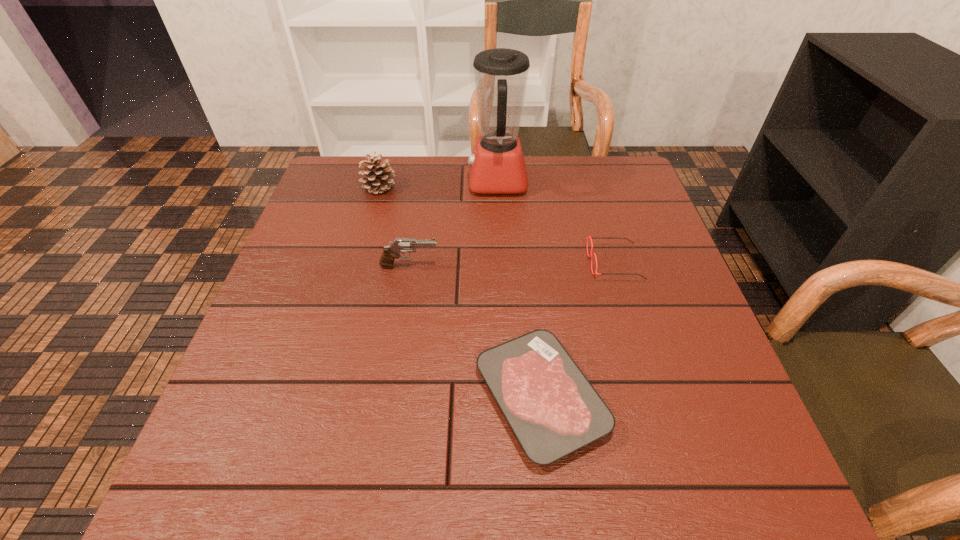
Locate an element on the screen. object that is at the near edge is located at coordinates (553, 410).

You are a GUI agent. You are given a task and a screenshot of the screen. Output one action in this format:
    pyautogui.click(x=<x>, y=<y>)
    Task: Click on the object that is at the left edge
    The height and width of the screenshot is (540, 960).
    Given the screenshot: What is the action you would take?
    pyautogui.click(x=379, y=175)

Locate an element on the screen. object situated at the right edge is located at coordinates (591, 255).

The width and height of the screenshot is (960, 540). Find the location of `object that is at the far left corner`. object that is at the far left corner is located at coordinates (379, 175).

You are a GUI agent. You are given a task and a screenshot of the screen. Output one action in this format:
    pyautogui.click(x=<x>, y=<y>)
    Task: Click on the vacant point at the far edge
    
    Given the screenshot: What is the action you would take?
    pyautogui.click(x=460, y=191)

In the image, there is a desktop. Identify the location of vacant space at the left edge. Image resolution: width=960 pixels, height=540 pixels. (348, 224).

At what (x,y) coordinates should I click in order to perform the action: click on free space at the right edge of the desktop. Please return your answer as a coordinate pair (x, y). Looking at the image, I should click on (619, 255).

The height and width of the screenshot is (540, 960). In the image, there is a desktop. Find the location of `vacant space at the far left corner`. vacant space at the far left corner is located at coordinates (337, 193).

Where is `free region at the far right corner`? The height and width of the screenshot is (540, 960). free region at the far right corner is located at coordinates (642, 190).

In the image, there is a desktop. Identify the location of vacant space at the near right corner. (716, 453).